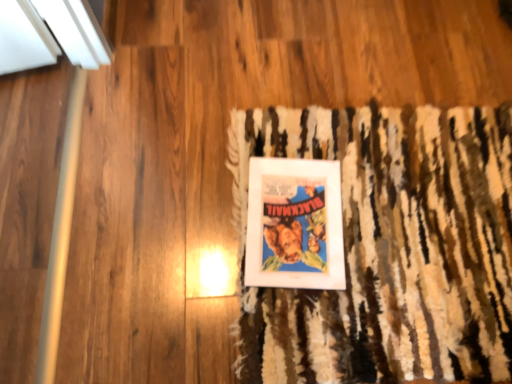
Find the location of a particular element. The image size is (512, 384). free space on the front side of matte paper poster at center is located at coordinates (316, 327).